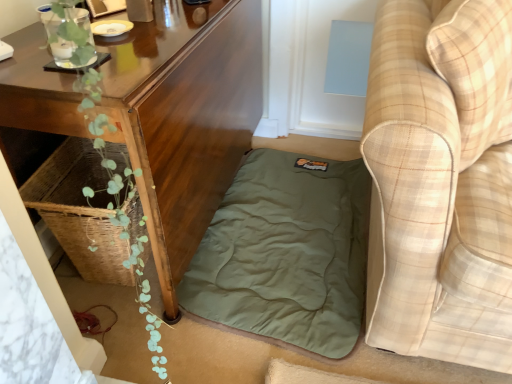
The image size is (512, 384). What do you see at coordinates (439, 181) in the screenshot?
I see `beige plaid fabric couch at lower right` at bounding box center [439, 181].

Image resolution: width=512 pixels, height=384 pixels. In order to click on olive green fabric mattress at lower center in this screenshot , I will do `click(286, 253)`.

Image resolution: width=512 pixels, height=384 pixels. Describe the element at coordinates (187, 126) in the screenshot. I see `wooden table at lower left` at that location.

Locate an element on the screen. beige plaid fabric couch at lower right is located at coordinates (439, 181).

Between olive green fabric mattress at lower center and beige plaid fabric couch at lower right, which one is positioned in front?

beige plaid fabric couch at lower right is more forward.

Considering the sizes of objects olive green fabric mattress at lower center and beige plaid fabric couch at lower right in the image provided, who is wider, olive green fabric mattress at lower center or beige plaid fabric couch at lower right?

Wider between the two is beige plaid fabric couch at lower right.

Is beige plaid fabric couch at lower right at the back of olive green fabric mattress at lower center?

olive green fabric mattress at lower center is not turned away from beige plaid fabric couch at lower right.

Looking at this image, which of these two, olive green fabric mattress at lower center or beige plaid fabric couch at lower right, is bigger?

beige plaid fabric couch at lower right.

Is beige plaid fabric couch at lower right surrounding wooden table at lower left?

Actually, wooden table at lower left is outside beige plaid fabric couch at lower right.

Is beige plaid fabric couch at lower right further to camera compared to wooden table at lower left?

No, beige plaid fabric couch at lower right is in front of wooden table at lower left.

Which point is more forward, [444,26] or [180,52]?

The point [444,26] is more forward.

Could beige plaid fabric couch at lower right be considered to be inside wooden table at lower left?

No, beige plaid fabric couch at lower right is not surrounded by wooden table at lower left.

From the picture: From a real-world perspective, which is physically below, wooden table at lower left or beige plaid fabric couch at lower right?

wooden table at lower left.

Is wooden table at lower left directly adjacent to beige plaid fabric couch at lower right?

No, wooden table at lower left is not touching beige plaid fabric couch at lower right.

Considering the sizes of objects wooden table at lower left and beige plaid fabric couch at lower right in the image provided, who is taller, wooden table at lower left or beige plaid fabric couch at lower right?

beige plaid fabric couch at lower right.

Does wooden table at lower left turn towards olive green fabric mattress at lower center?

Yes, wooden table at lower left is aimed at olive green fabric mattress at lower center.

How many degrees apart are the facing directions of wooden table at lower left and olive green fabric mattress at lower center?

The angular difference between wooden table at lower left and olive green fabric mattress at lower center is 90.1 degrees.

Consider the image. Considering the relative sizes of wooden table at lower left and olive green fabric mattress at lower center in the image provided, is wooden table at lower left smaller than olive green fabric mattress at lower center?

Actually, wooden table at lower left might be larger than olive green fabric mattress at lower center.

From a real-world perspective, is wooden table at lower left under olive green fabric mattress at lower center?

No.

Does olive green fabric mattress at lower center have a larger size compared to wooden table at lower left?

No, olive green fabric mattress at lower center is not bigger than wooden table at lower left.

From the picture: Which object is wider, olive green fabric mattress at lower center or wooden table at lower left?

With larger width is olive green fabric mattress at lower center.

Does olive green fabric mattress at lower center have a lesser height compared to wooden table at lower left?

Yes.

The image size is (512, 384). I want to click on mattress on the right of wooden table at lower left, so click(x=286, y=253).

Is beige plaid fabric couch at lower right surrounding olive green fabric mattress at lower center?

No, olive green fabric mattress at lower center is located outside of beige plaid fabric couch at lower right.

From a real-world perspective, which is physically above, beige plaid fabric couch at lower right or olive green fabric mattress at lower center?

In real-world perspective, beige plaid fabric couch at lower right is above.

Are beige plaid fabric couch at lower right and olive green fabric mattress at lower center located far from each other?

beige plaid fabric couch at lower right is actually quite close to olive green fabric mattress at lower center.

Is beige plaid fabric couch at lower right thinner than olive green fabric mattress at lower center?

No.

Image resolution: width=512 pixels, height=384 pixels. What are the coordinates of `studio couch that appears above the olive green fabric mattress at lower center (from a real-world perspective)` in the screenshot? It's located at (439, 181).

Locate an element on the screen. studio couch in front of the wooden table at lower left is located at coordinates (439, 181).

When comparing their distances from beige plaid fabric couch at lower right, does wooden table at lower left or olive green fabric mattress at lower center seem closer?

Among the two, olive green fabric mattress at lower center is located nearer to beige plaid fabric couch at lower right.

Considering their positions, is olive green fabric mattress at lower center positioned closer to beige plaid fabric couch at lower right than wooden table at lower left?

Based on the image, olive green fabric mattress at lower center appears to be nearer to beige plaid fabric couch at lower right.

Based on the photo, from the image, which object appears to be farther from olive green fabric mattress at lower center, wooden table at lower left or beige plaid fabric couch at lower right?

beige plaid fabric couch at lower right lies further to olive green fabric mattress at lower center than the other object.

Considering their positions, is beige plaid fabric couch at lower right positioned closer to wooden table at lower left than olive green fabric mattress at lower center?

olive green fabric mattress at lower center lies closer to wooden table at lower left than the other object.

Which object lies further to the anchor point olive green fabric mattress at lower center, beige plaid fabric couch at lower right or wooden table at lower left?

Based on the image, beige plaid fabric couch at lower right appears to be further to olive green fabric mattress at lower center.

Considering their positions, is olive green fabric mattress at lower center positioned closer to wooden table at lower left than beige plaid fabric couch at lower right?

olive green fabric mattress at lower center is positioned closer to the anchor wooden table at lower left.

What are the coordinates of `mattress between wooden table at lower left and beige plaid fabric couch at lower right in the horizontal direction` in the screenshot? It's located at (286, 253).